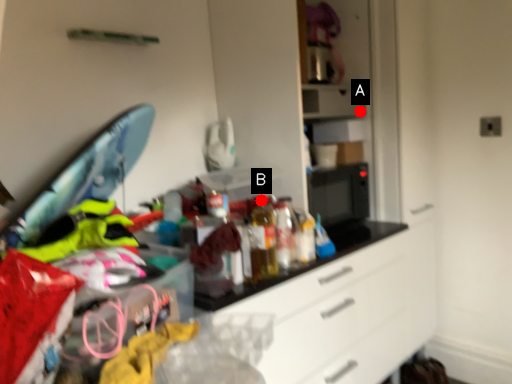
Question: Two points are circled on the image, labeled by A and B beside each circle. Which point is farther from the camera taking this photo?

Choices:
 (A) A is further
 (B) B is further

Answer: (A)